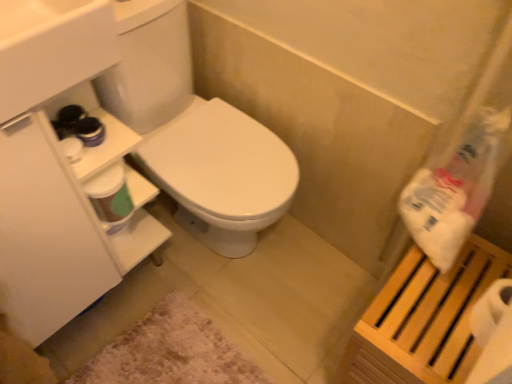
Question: From the image's perspective, is white plastic bag at upper right under wooden slatted shelf at right?

Choices:
 (A) yes
 (B) no

Answer: (B)

Question: From a real-world perspective, is white plastic bag at upper right located beneath wooden slatted shelf at right?

Choices:
 (A) yes
 (B) no

Answer: (B)

Question: Would you say white plastic bag at upper right contains wooden slatted shelf at right?

Choices:
 (A) no
 (B) yes

Answer: (A)

Question: Is white plastic bag at upper right positioned behind wooden slatted shelf at right?

Choices:
 (A) yes
 (B) no

Answer: (B)

Question: From the image's perspective, is white plastic bag at upper right located above wooden slatted shelf at right?

Choices:
 (A) no
 (B) yes

Answer: (B)

Question: Is wooden slatted shelf at right taller or shorter than white plastic bag at upper right?

Choices:
 (A) tall
 (B) short

Answer: (A)

Question: Considering the relative positions of wooden slatted shelf at right and white plastic bag at upper right in the image provided, is wooden slatted shelf at right to the left or to the right of white plastic bag at upper right?

Choices:
 (A) right
 (B) left

Answer: (A)

Question: Is wooden slatted shelf at right wider or thinner than white plastic bag at upper right?

Choices:
 (A) wide
 (B) thin

Answer: (A)

Question: Based on their sizes in the image, would you say wooden slatted shelf at right is bigger or smaller than white plastic bag at upper right?

Choices:
 (A) small
 (B) big

Answer: (B)

Question: In the image, is wooden slatted shelf at right positioned in front of or behind white matte toilet paper at right?

Choices:
 (A) front
 (B) behind

Answer: (B)

Question: Is wooden slatted shelf at right spatially inside white matte toilet paper at right, or outside of it?

Choices:
 (A) outside
 (B) inside

Answer: (A)

Question: Looking at their shapes, would you say wooden slatted shelf at right is wider or thinner than white matte toilet paper at right?

Choices:
 (A) thin
 (B) wide

Answer: (B)

Question: From their relative heights in the image, would you say wooden slatted shelf at right is taller or shorter than white matte toilet paper at right?

Choices:
 (A) tall
 (B) short

Answer: (A)

Question: Visually, is wooden slatted shelf at right positioned to the left or to the right of white glossy sink at upper left?

Choices:
 (A) left
 (B) right

Answer: (B)

Question: In terms of height, does wooden slatted shelf at right look taller or shorter compared to white glossy sink at upper left?

Choices:
 (A) tall
 (B) short

Answer: (A)